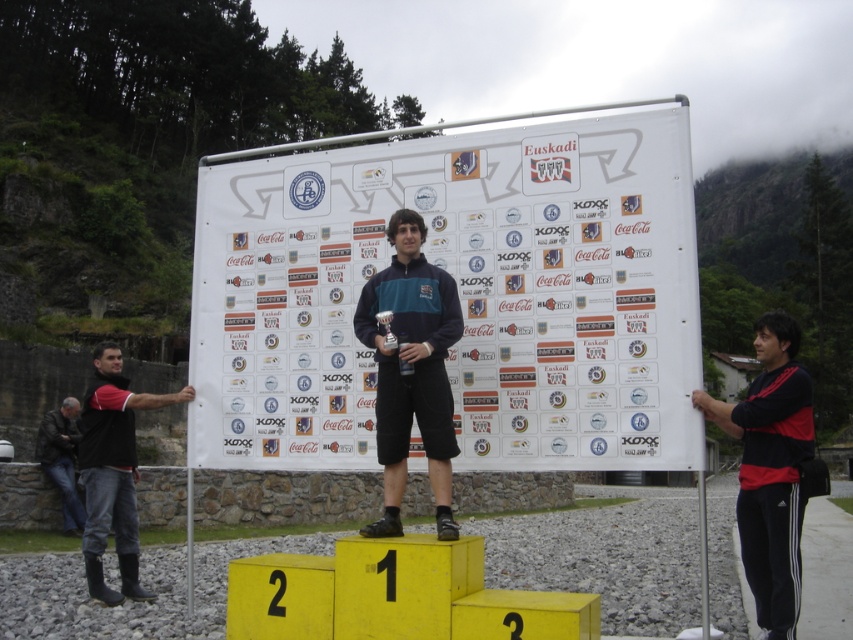
You are a photographer at the event and need to capture a photo of the dark blue jersey at center and the leather jacket at left. Which clothing item appears narrower in the photo?

The dark blue jersey at center appears narrower in the photo since it has a lesser width compared to the leather jacket at left.

You are standing at the podium where the winner is holding a trophy. There is a point marked at coordinates (113, 472). What object is this point located on?

The point marked at coordinates (113, 472) is located on the black rubber boots at left.